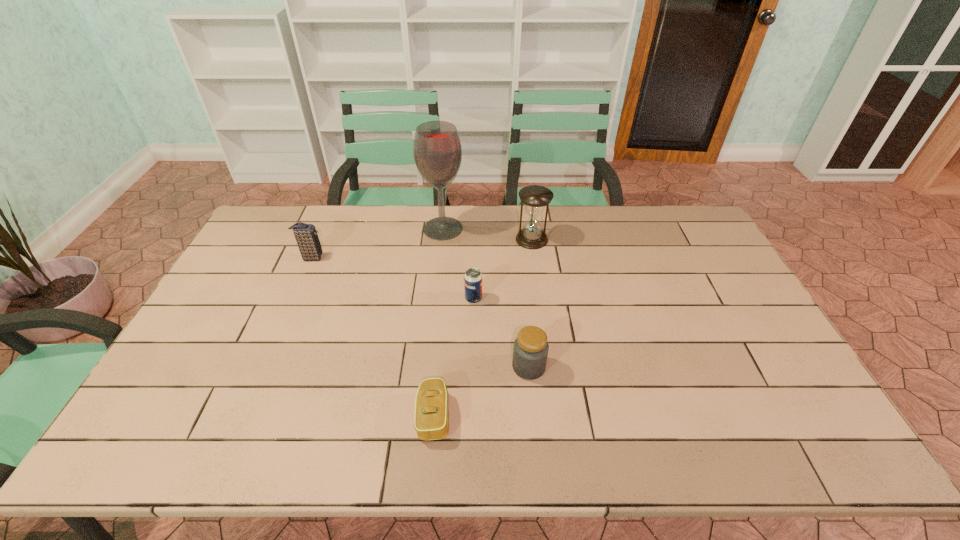
This screenshot has height=540, width=960. Find the location of `free space between the beer can and the nearest object`. free space between the beer can and the nearest object is located at coordinates (454, 357).

Where is `vacant area that lies between the tallest object and the shorter clutch bag`? This screenshot has width=960, height=540. vacant area that lies between the tallest object and the shorter clutch bag is located at coordinates (439, 322).

Identify the location of free space between the second tallest object and the jar. (530, 303).

You are a GUI agent. You are given a task and a screenshot of the screen. Output one action in this format:
    pyautogui.click(x=<x>, y=<y>)
    Task: Click on the vacant point located between the tallest object and the jar
    The width and height of the screenshot is (960, 540).
    Given the screenshot: What is the action you would take?
    pyautogui.click(x=486, y=298)

At what (x,y) coordinates should I click in order to perform the action: click on object that is the fifth closest to the nearest object. Please return your answer as a coordinate pair (x, y). Image resolution: width=960 pixels, height=540 pixels. Looking at the image, I should click on (306, 236).

Locate an element on the screen. the closest object to the second nearest object is located at coordinates (431, 422).

What are the coordinates of `vacant space that satisfies the following two spatial constraints: 1. on the back side of the third object from right to left; 2. on the left side of the fifth shortest object` in the screenshot? It's located at (474, 239).

This screenshot has width=960, height=540. Identify the location of vacant space that satisfies the following two spatial constraints: 1. on the back side of the fourth object from left to right; 2. with the zip open on the farther clutch bag. (474, 258).